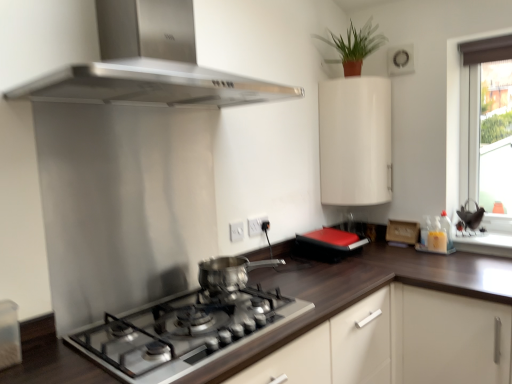
I want to click on satin silver gas stove at center, so (183, 332).

The image size is (512, 384). What do you see at coordinates (150, 85) in the screenshot?
I see `stainless steel range hood at upper center` at bounding box center [150, 85].

What do you see at coordinates (355, 46) in the screenshot? The height and width of the screenshot is (384, 512). I see `green matte plant at upper right` at bounding box center [355, 46].

The image size is (512, 384). What do you see at coordinates (230, 272) in the screenshot?
I see `polished silver pot at center` at bounding box center [230, 272].

You are a GUI agent. You are given a task and a screenshot of the screen. Output one action in this format:
    pyautogui.click(x=<x>, y=<y>)
    Task: Click on the satin silver gas stove at center
    This screenshot has height=384, width=512.
    Given the screenshot: What is the action you would take?
    pyautogui.click(x=183, y=332)

Looking at this image, is the depth of white glossy cabinet at upper right greater than that of polished silver pot at center?

Yes, the depth of white glossy cabinet at upper right is greater than that of polished silver pot at center.

From the image's perspective, is white glossy cabinet at upper right located beneath polished silver pot at center?

Incorrect, from the image's perspective, white glossy cabinet at upper right is higher than polished silver pot at center.

Does white glossy cabinet at upper right turn towards polished silver pot at center?

No, white glossy cabinet at upper right is not oriented towards polished silver pot at center.

Can you tell me how much satin silver gas stove at center and dark wood countertop at center differ in facing direction?

There is a 0.501-degree angle between the facing directions of satin silver gas stove at center and dark wood countertop at center.

What are the coordinates of `gas stove on the left of dark wood countertop at center` in the screenshot? It's located at coord(183,332).

Measure the distance between satin silver gas stove at center and dark wood countertop at center.

The distance of satin silver gas stove at center from dark wood countertop at center is 10.95 inches.

Between satin silver gas stove at center and dark wood countertop at center, which one has smaller width?

With smaller width is satin silver gas stove at center.

Can you confirm if matte brown curtain at upper right is smaller than green matte plant at upper right?

Actually, matte brown curtain at upper right might be larger than green matte plant at upper right.

Is green matte plant at upper right surrounded by matte brown curtain at upper right?

That's incorrect, green matte plant at upper right is not inside matte brown curtain at upper right.

Which object is wider, matte brown curtain at upper right or green matte plant at upper right?

With larger width is green matte plant at upper right.

From the picture: Which object is further away from the camera taking this photo, matte brown curtain at upper right or green matte plant at upper right?

matte brown curtain at upper right is further away from the camera.

Does point (354, 91) come closer to viewer compared to point (347, 42)?

That is True.

From the image's perspective, would you say white glossy cabinet at upper right is positioned over green matte plant at upper right?

Incorrect, from the image's perspective, white glossy cabinet at upper right is lower than green matte plant at upper right.

Who is more distant, white glossy cabinet at upper right or green matte plant at upper right?

white glossy cabinet at upper right is behind.

Is white glossy cabinet at upper right to the left or to the right of green matte plant at upper right in the image?

Clearly, white glossy cabinet at upper right is on the right of green matte plant at upper right in the image.

Is dark wood countertop at center situated inside green matte plant at upper right or outside?

dark wood countertop at center is located beyond the bounds of green matte plant at upper right.

Can you confirm if dark wood countertop at center is smaller than green matte plant at upper right?

A: Incorrect, dark wood countertop at center is not smaller in size than green matte plant at upper right.

Does dark wood countertop at center lie in front of green matte plant at upper right?

Yes, dark wood countertop at center is closer to the viewer.

Is dark wood countertop at center oriented away from green matte plant at upper right?

No.

Can you confirm if green matte plant at upper right is positioned to the right of satin silver gas stove at center?

Yes, green matte plant at upper right is to the right of satin silver gas stove at center.

Is green matte plant at upper right not within satin silver gas stove at center?

Yes, green matte plant at upper right is outside of satin silver gas stove at center.

Is point (330, 44) farther from camera compared to point (111, 333)?

Yes, point (330, 44) is farther from viewer.

In the image, is white glossy cabinet at upper right positioned in front of or behind matte brown curtain at upper right?

white glossy cabinet at upper right is behind matte brown curtain at upper right.

This screenshot has width=512, height=384. I want to click on cabinetry lying below the matte brown curtain at upper right (from the image's perspective), so click(x=355, y=141).

You are a GUI agent. You are given a task and a screenshot of the screen. Output one action in this format:
    pyautogui.click(x=<x>, y=<y>)
    Task: Click on the kitchen appliance located underneath the white glossy cabinet at upper right (from a real-world perspective)
    The height and width of the screenshot is (384, 512).
    Given the screenshot: What is the action you would take?
    pyautogui.click(x=230, y=272)

Find the location of `countertop located in front of the satin silver gas stove at center`. countertop located in front of the satin silver gas stove at center is located at coordinates (370, 286).

From the image, which object appears to be nearer to polished silver pot at center, stainless steel range hood at upper center or matte brown curtain at upper right?

stainless steel range hood at upper center.

From the image, which object appears to be nearer to stainless steel range hood at upper center, satin silver gas stove at center or white glossy cabinet at upper right?

white glossy cabinet at upper right.

Which object lies further to the anchor point matte brown curtain at upper right, dark wood countertop at center or green matte plant at upper right?

Among the two, dark wood countertop at center is located further to matte brown curtain at upper right.

Estimate the real-world distances between objects in this image. Which object is closer to green matte plant at upper right, matte brown curtain at upper right or white glossy cabinet at upper right?

white glossy cabinet at upper right.

Which object lies further to the anchor point polished silver pot at center, green matte plant at upper right or stainless steel range hood at upper center?

Among the two, green matte plant at upper right is located further to polished silver pot at center.

Estimate the real-world distances between objects in this image. Which object is closer to white glossy cabinet at upper right, polished silver pot at center or dark wood countertop at center?

Based on the image, dark wood countertop at center appears to be nearer to white glossy cabinet at upper right.

From the image, which object appears to be farther from matte brown curtain at upper right, satin silver gas stove at center or white glossy cabinet at upper right?

satin silver gas stove at center is further to matte brown curtain at upper right.

Consider the image. From the image, which object appears to be farther from matte brown curtain at upper right, green matte plant at upper right or white glossy cabinet at upper right?

Among the two, green matte plant at upper right is located further to matte brown curtain at upper right.

You are a GUI agent. You are given a task and a screenshot of the screen. Output one action in this format:
    pyautogui.click(x=<x>, y=<y>)
    Task: Click on the kitchen appliance between stainless steel range hood at upper center and dark wood countertop at center vertically
    This screenshot has width=512, height=384.
    Given the screenshot: What is the action you would take?
    pyautogui.click(x=230, y=272)

Where is `kitchen appliance located between satin silver gas stove at center and matte brown curtain at upper right in the left-right direction`? kitchen appliance located between satin silver gas stove at center and matte brown curtain at upper right in the left-right direction is located at coordinates (230, 272).

Locate an element on the screen. The image size is (512, 384). cabinetry between polished silver pot at center and matte brown curtain at upper right from left to right is located at coordinates (355, 141).

Where is `plant between satin silver gas stove at center and matte brown curtain at upper right`? The height and width of the screenshot is (384, 512). plant between satin silver gas stove at center and matte brown curtain at upper right is located at coordinates (355, 46).